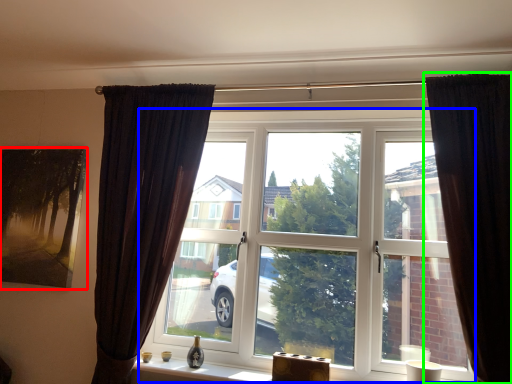
Question: Which object is the farthest from picture frame (highlighted by a red box)? Choose among these: window (highlighted by a blue box) or curtain (highlighted by a green box).

Choices:
 (A) window
 (B) curtain

Answer: (B)